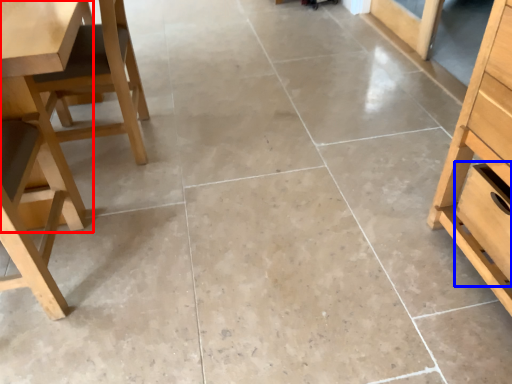
Question: Which of the following is the closest to the observer, table (highlighted by a red box) or drawer (highlighted by a blue box)?

Choices:
 (A) table
 (B) drawer

Answer: (A)